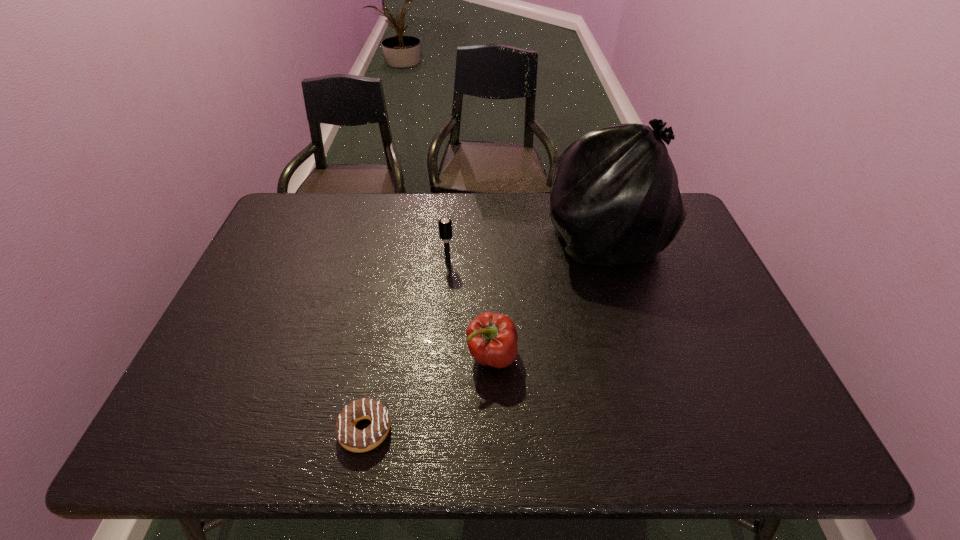
Identify the location of free space located 0.120m on the front of the second nearest object. The image size is (960, 540). (493, 427).

The image size is (960, 540). I want to click on free spot located on the right of the shortest object, so click(x=423, y=430).

Locate an element on the screen. The image size is (960, 540). object that is at the far edge is located at coordinates click(x=615, y=199).

Where is `object that is at the near edge`? object that is at the near edge is located at coordinates (355, 440).

Where is `object located in the right edge section of the desktop`? The image size is (960, 540). object located in the right edge section of the desktop is located at coordinates (615, 199).

Locate an element on the screen. This screenshot has width=960, height=540. object that is positioned at the far right corner is located at coordinates (615, 199).

Identify the location of free space at the far edge. The height and width of the screenshot is (540, 960). click(x=359, y=227).

What are the coordinates of `free space at the near edge of the desktop` in the screenshot? It's located at (306, 434).

The width and height of the screenshot is (960, 540). I want to click on vacant space at the left edge, so click(296, 268).

Find the location of a particular element. This screenshot has width=960, height=540. vacant space at the right edge is located at coordinates (702, 305).